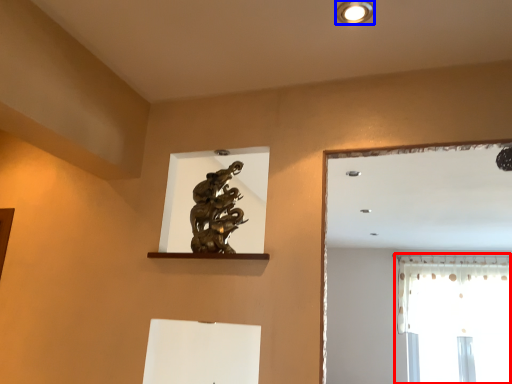
Question: Among these objects, which one is farthest to the camera, window (highlighted by a red box) or lighting (highlighted by a blue box)?

Choices:
 (A) window
 (B) lighting

Answer: (A)